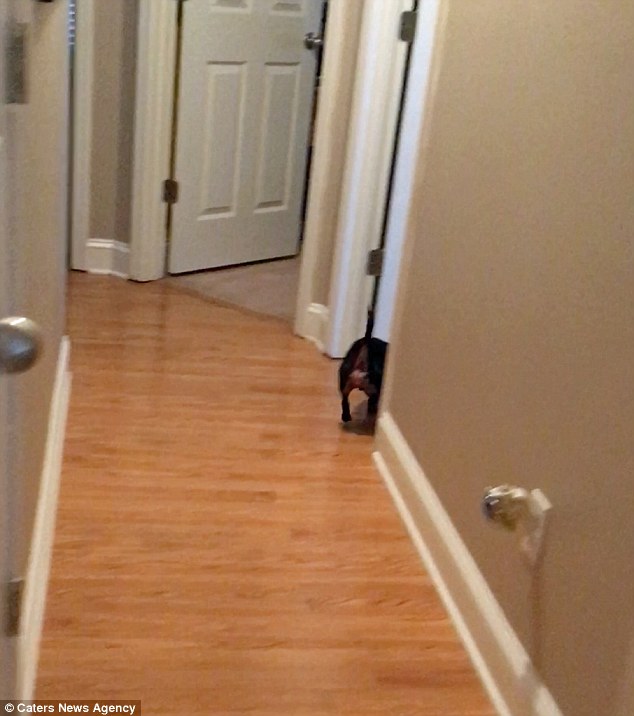
Where is `window`? window is located at coordinates (70, 29).